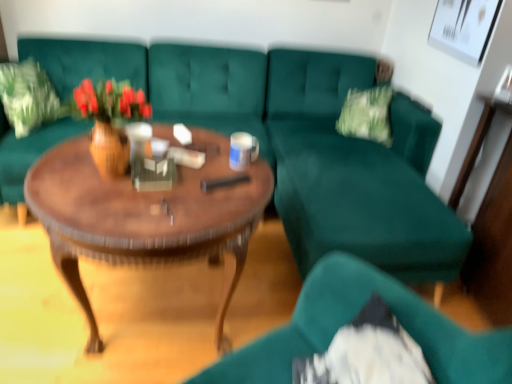
Question: Is wooden polished coffee table at center next to wooden vase with flowers at center and touching it?

Choices:
 (A) no
 (B) yes

Answer: (A)

Question: Does wooden polished coffee table at center have a lesser height compared to wooden vase with flowers at center?

Choices:
 (A) no
 (B) yes

Answer: (A)

Question: Is wooden polished coffee table at center smaller than wooden vase with flowers at center?

Choices:
 (A) yes
 (B) no

Answer: (B)

Question: From a real-world perspective, is wooden polished coffee table at center beneath wooden vase with flowers at center?

Choices:
 (A) no
 (B) yes

Answer: (B)

Question: Is wooden polished coffee table at center positioned with its back to wooden vase with flowers at center?

Choices:
 (A) no
 (B) yes

Answer: (A)

Question: From the image's perspective, is wooden vase with flowers at center located above or below wooden polished coffee table at center?

Choices:
 (A) above
 (B) below

Answer: (A)

Question: Based on their sizes in the image, would you say wooden vase with flowers at center is bigger or smaller than wooden polished coffee table at center?

Choices:
 (A) big
 (B) small

Answer: (B)

Question: From a real-world perspective, is wooden vase with flowers at center positioned above or below wooden polished coffee table at center?

Choices:
 (A) above
 (B) below

Answer: (A)

Question: In terms of height, does wooden vase with flowers at center look taller or shorter compared to wooden polished coffee table at center?

Choices:
 (A) tall
 (B) short

Answer: (B)

Question: From a real-world perspective, is teal fabric chair at lower right positioned above or below wooden vase with flowers at center?

Choices:
 (A) below
 (B) above

Answer: (A)

Question: Is teal fabric chair at lower right taller or shorter than wooden vase with flowers at center?

Choices:
 (A) short
 (B) tall

Answer: (B)

Question: From the image's perspective, is teal fabric chair at lower right located above or below wooden vase with flowers at center?

Choices:
 (A) above
 (B) below

Answer: (B)

Question: Is point (431, 362) closer or farther from the camera than point (75, 100)?

Choices:
 (A) farther
 (B) closer

Answer: (B)

Question: From the image's perspective, is green fabric pillow at upper left positioned above or below teal fabric chair at lower right?

Choices:
 (A) below
 (B) above

Answer: (B)

Question: Is green fabric pillow at upper left inside the boundaries of teal fabric chair at lower right, or outside?

Choices:
 (A) outside
 (B) inside

Answer: (A)